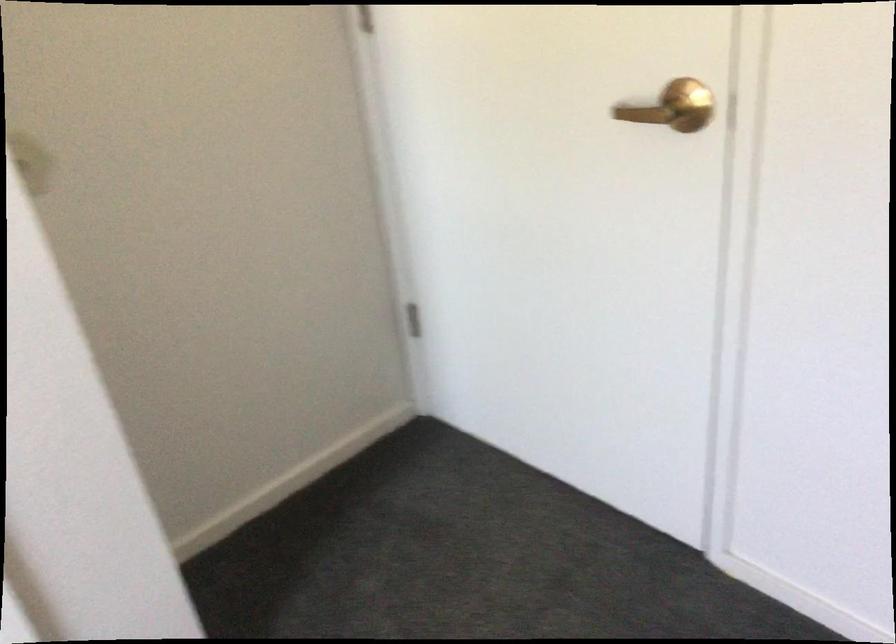
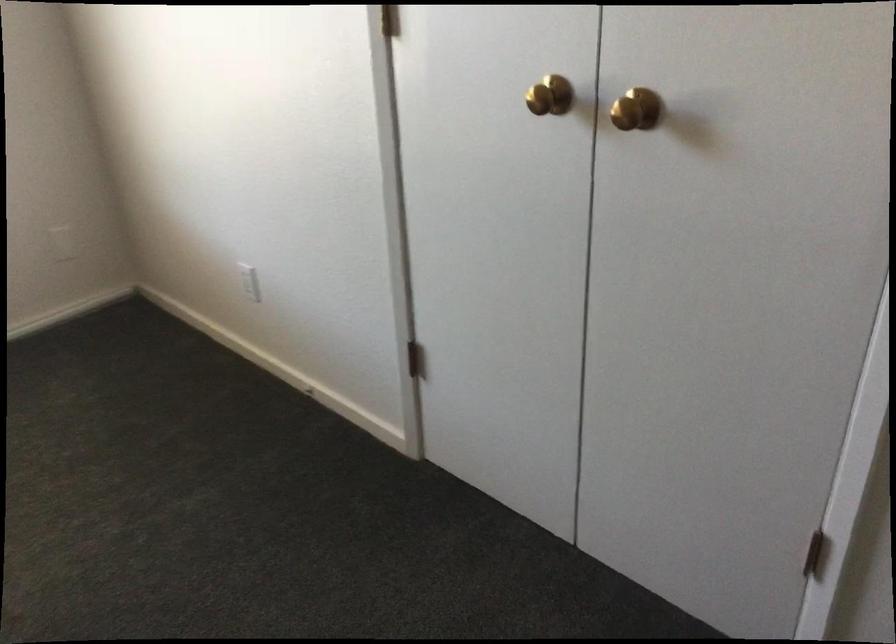
The images are taken continuously from a first-person perspective. In which direction is your viewpoint rotating?

The camera's rotation is toward left-down.